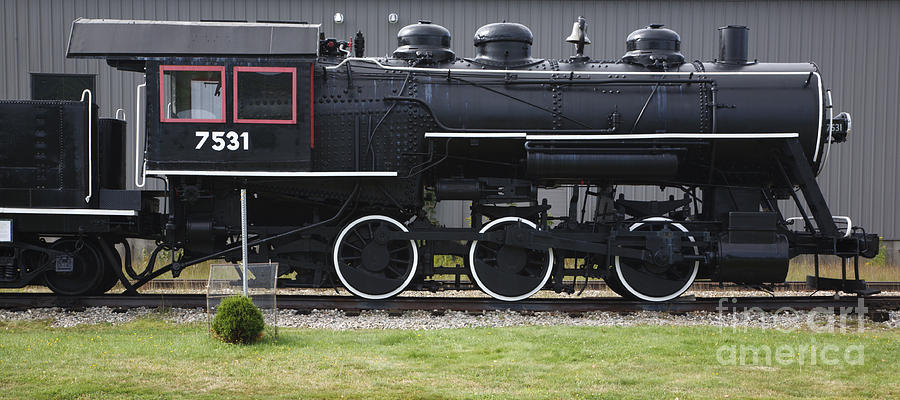
At what (x,y) coordinates should I click in order to perform the action: click on window. Please return your answer as a coordinate pair (x, y). The width and height of the screenshot is (900, 400). Looking at the image, I should click on click(209, 101), click(262, 78).